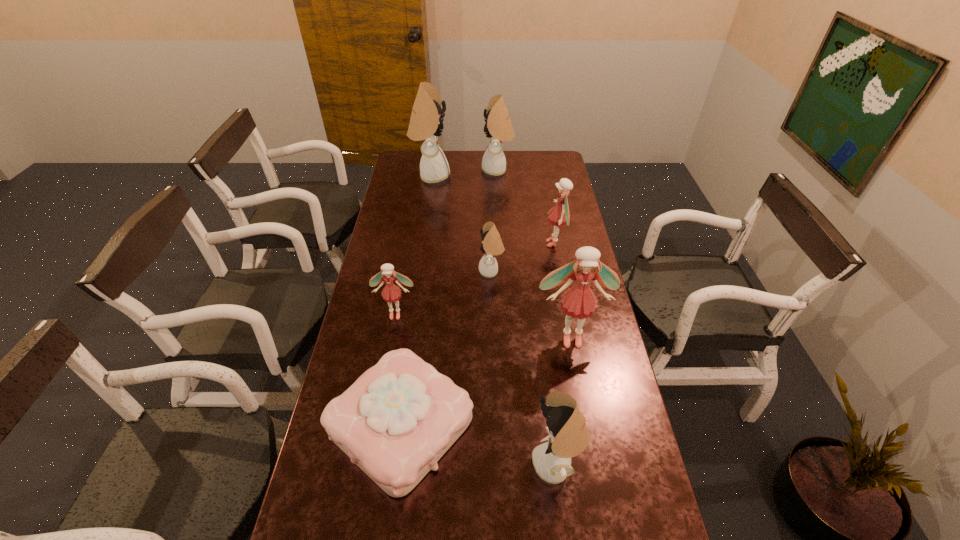
Image resolution: width=960 pixels, height=540 pixels. I want to click on object situated at the far left corner, so click(426, 123).

At what (x,y) coordinates should I click in order to perform the action: click on blank space at the far edge of the desktop. Please return your answer as a coordinate pair (x, y). Looking at the image, I should click on (520, 152).

The width and height of the screenshot is (960, 540). Identify the location of vacant space at the left edge of the desktop. (384, 237).

Locate an element on the screen. free space at the right edge of the desktop is located at coordinates click(x=593, y=367).

The height and width of the screenshot is (540, 960). In the image, there is a desktop. What are the coordinates of `vacant space at the far left corner` in the screenshot? It's located at (419, 161).

The image size is (960, 540). I want to click on free space between the biggest black doll and the third nearest doll, so click(x=414, y=245).

Find the location of a particular element. The width and height of the screenshot is (960, 540). empty space that is in between the farthest pink doll and the tallest object is located at coordinates (493, 210).

I want to click on free spot between the biggest black doll and the nearest black doll, so [493, 320].

Find the location of a particular element. vacant space that's between the second smallest black doll and the shortest object is located at coordinates (479, 444).

Find the location of a particular element. The width and height of the screenshot is (960, 540). vacant space in between the tallest object and the third farthest black doll is located at coordinates (461, 224).